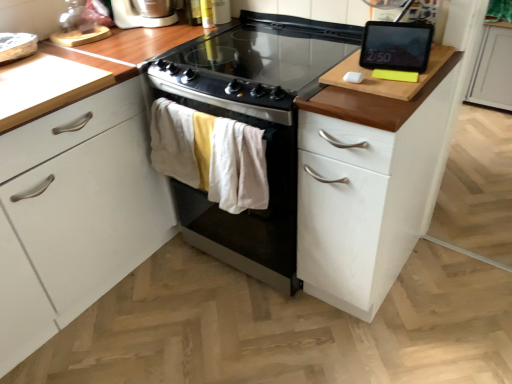
Identify the location of vacant space to the right of white wood cabinet at right. This screenshot has height=384, width=512. (449, 284).